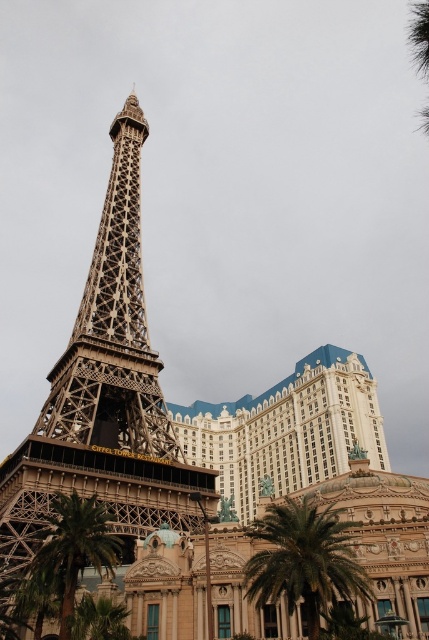
Question: Is metallic gold tower at center positioned before green leafy palm tree at lower left?

Choices:
 (A) yes
 (B) no

Answer: (B)

Question: Can you confirm if green leafy palm tree at center is bigger than green leafy palm tree at lower left?

Choices:
 (A) no
 (B) yes

Answer: (B)

Question: Which is farther from the green leafy palm tree at center?

Choices:
 (A) metallic gold tower at center
 (B) green leafy palm tree at lower left

Answer: (A)

Question: Is metallic gold tower at center further to the viewer compared to green leafy palm tree at lower left?

Choices:
 (A) yes
 (B) no

Answer: (A)

Question: Which object appears closest to the camera in this image?

Choices:
 (A) metallic gold tower at center
 (B) green leafy palm tree at center

Answer: (B)

Question: Estimate the real-world distances between objects in this image. Which object is farther from the green leafy palm tree at lower left?

Choices:
 (A) metallic gold tower at center
 (B) green leafy palm tree at center

Answer: (B)